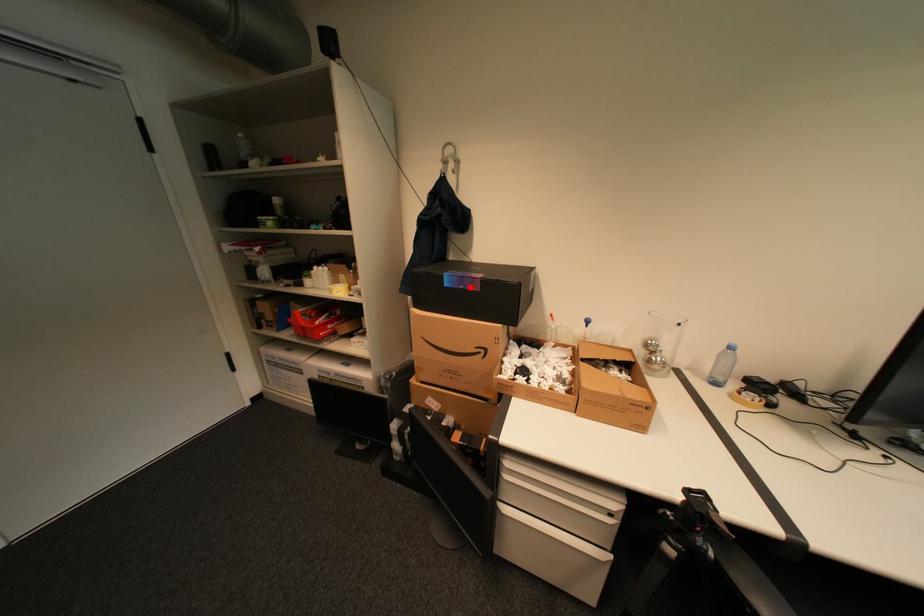
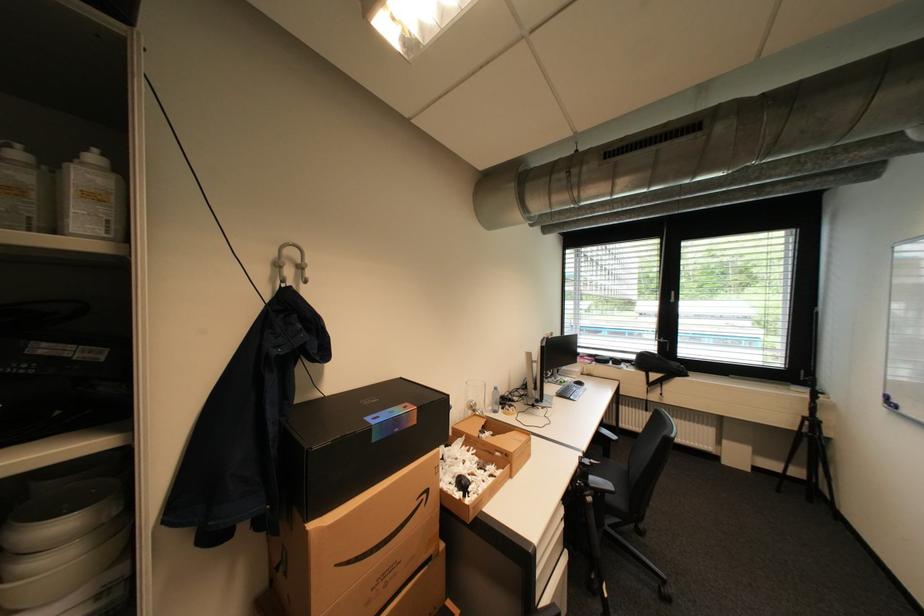
In the second image, find the point that corresponds to the highlighted location in the first image.

(405, 431)